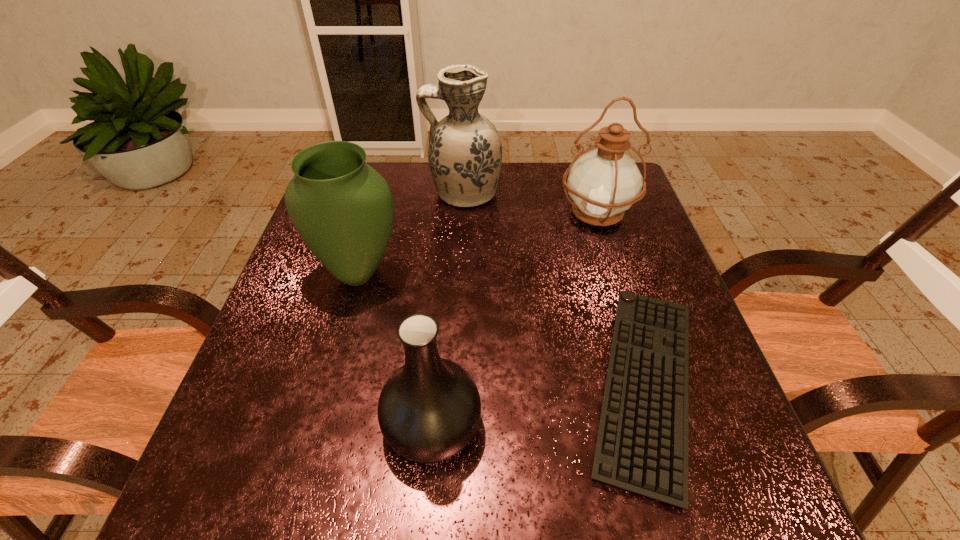
Where is `blank area located 0.270m on the back of the second nearest vase`? This screenshot has height=540, width=960. blank area located 0.270m on the back of the second nearest vase is located at coordinates (382, 191).

I want to click on vacant space situated on the back of the nearest vase, so click(442, 307).

The image size is (960, 540). Find the location of `free space located 0.400m on the left of the computer keyboard`. free space located 0.400m on the left of the computer keyboard is located at coordinates (362, 384).

Image resolution: width=960 pixels, height=540 pixels. Identify the location of vase that is at the far edge. (465, 152).

Image resolution: width=960 pixels, height=540 pixels. I want to click on oil lamp that is positioned at the far edge, so click(x=603, y=183).

Find the location of a particular element. The width and height of the screenshot is (960, 540). vase that is at the near edge is located at coordinates (429, 409).

The height and width of the screenshot is (540, 960). I want to click on computer keyboard located in the near edge section of the desktop, so click(x=642, y=444).

Where is `object located at the left edge`? Image resolution: width=960 pixels, height=540 pixels. object located at the left edge is located at coordinates (343, 209).

You are a GUI agent. You are given a task and a screenshot of the screen. Output one action in this format:
    pyautogui.click(x=<x>, y=<y>)
    Task: Click on the oil lamp at the right edge
    This screenshot has height=540, width=960.
    Given the screenshot: What is the action you would take?
    pyautogui.click(x=603, y=183)

Find the location of a particular element. This screenshot has height=540, width=960. computer keyboard that is positioned at the right edge is located at coordinates (642, 444).